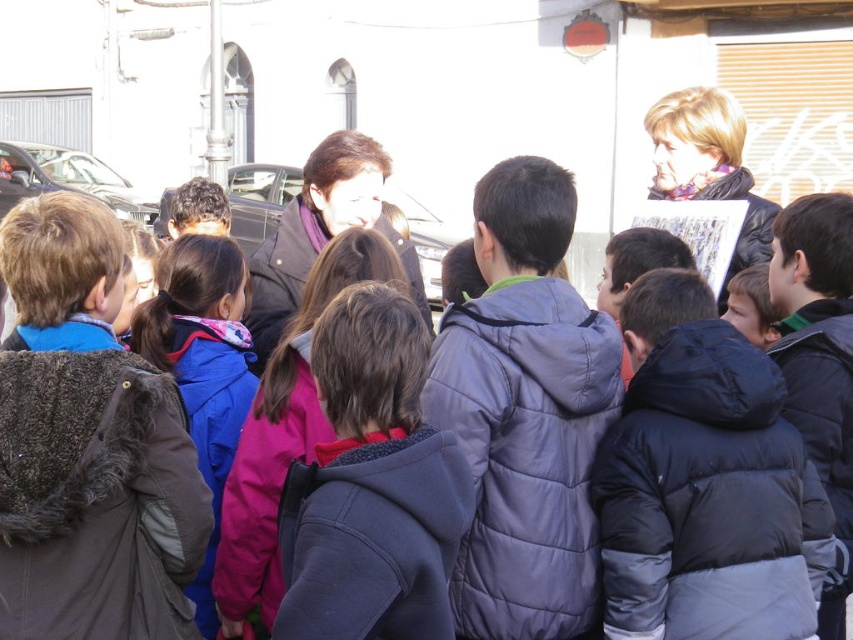
Question: Among these points, which one is farthest from the camera?

Choices:
 (A) (229, 426)
 (B) (497, 346)
 (C) (793, 428)
 (D) (383, 342)

Answer: (A)

Question: Does dark blue puffy jacket at center have a lesser width compared to dark gray fleece jacket at center?

Choices:
 (A) yes
 (B) no

Answer: (B)

Question: Among these points, which one is nearest to the camera?

Choices:
 (A) (397, 460)
 (B) (514, 456)
 (C) (210, 547)
 (D) (706, 452)

Answer: (A)

Question: Estimate the real-world distances between objects in this image. Which object is closer to the dark gray fleece jacket at center?

Choices:
 (A) black puffy jacket at center
 (B) pink fleece jacket at center
 (C) dark blue puffy jacket at center

Answer: (C)

Question: Is dark blue puffy jacket at center thinner than pink fleece jacket at center?

Choices:
 (A) yes
 (B) no

Answer: (B)

Question: Is dark blue puffy jacket at center above dark gray fleece jacket at center?

Choices:
 (A) no
 (B) yes

Answer: (B)